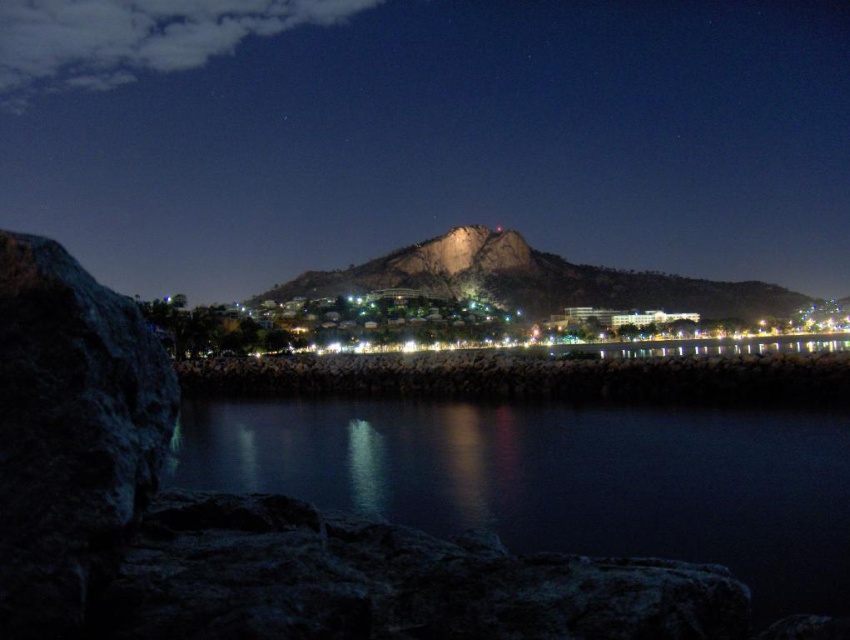
Question: Among these objects, which one is farthest from the camera?

Choices:
 (A) rocky brown mountain at center
 (B) rocky cliff at left

Answer: (B)

Question: Is rocky cliff at left above rocky brown mountain at center?

Choices:
 (A) yes
 (B) no

Answer: (A)

Question: In this image, where is rocky cliff at left located relative to smooth dark water at center?

Choices:
 (A) above
 (B) below

Answer: (A)

Question: Among these points, which one is farthest from the camera?

Choices:
 (A) (816, 237)
 (B) (836, 508)

Answer: (A)

Question: Which point appears farthest from the camera in this image?

Choices:
 (A) (842, 529)
 (B) (494, 300)

Answer: (B)

Question: Is rocky cliff at left behind rocky brown mountain at center?

Choices:
 (A) no
 (B) yes

Answer: (B)